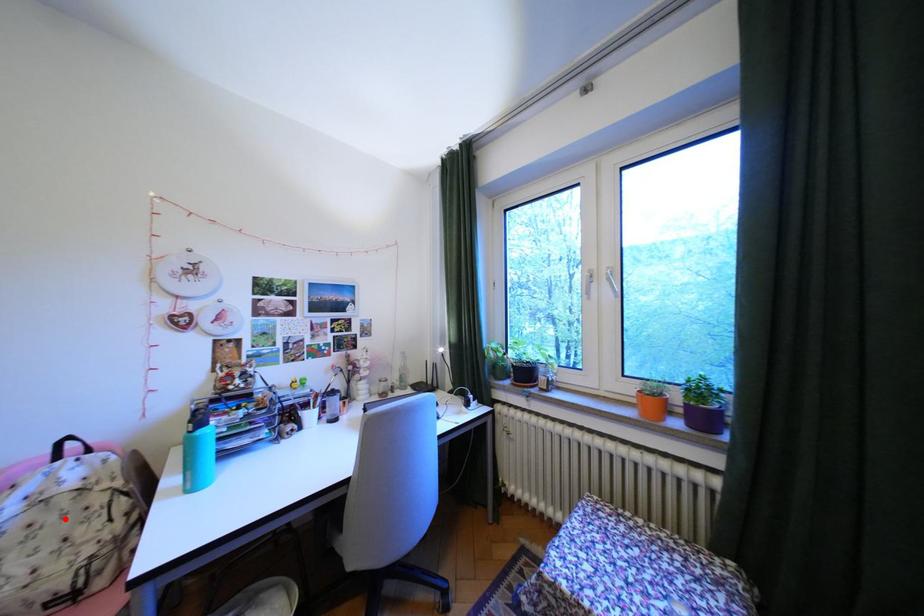
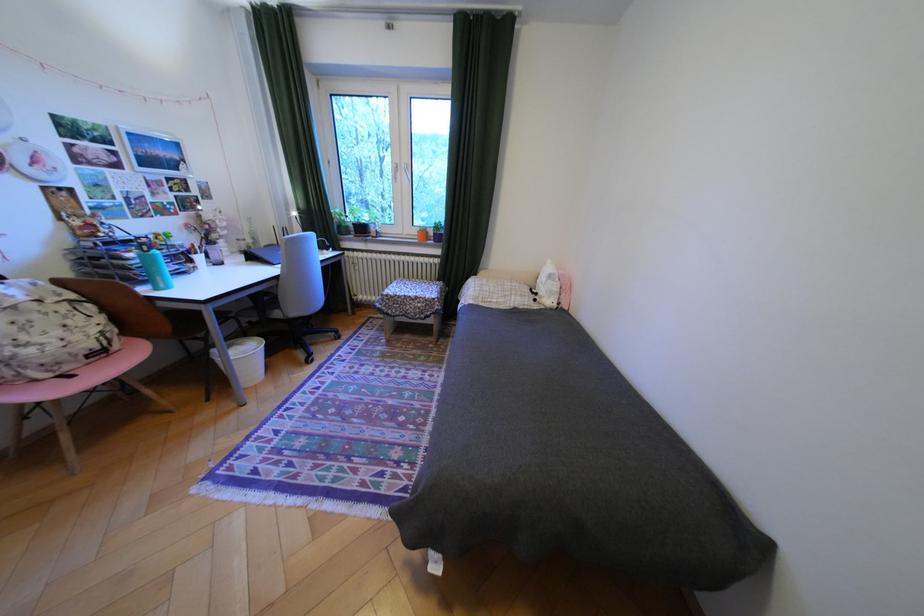
The point at the highlighted location is marked in the first image. Where is the corresponding point in the second image?

(49, 317)